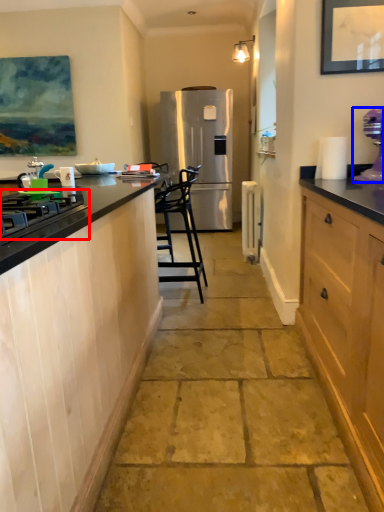
Question: Which object is further to the camera taking this photo, gas stove (highlighted by a red box) or kitchen appliance (highlighted by a blue box)?

Choices:
 (A) gas stove
 (B) kitchen appliance

Answer: (B)